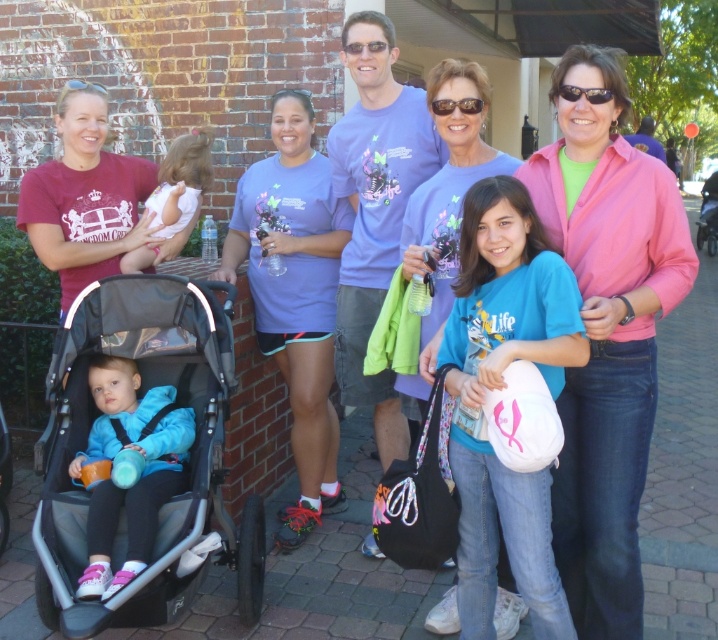
Question: Observing the image, what is the correct spatial positioning of pink fabric jacket at upper right in reference to maroon t-shirt at left?

Choices:
 (A) above
 (B) below

Answer: (B)

Question: Does pink satin jacket at center have a greater width compared to matte blue t-shirt at center?

Choices:
 (A) no
 (B) yes

Answer: (B)

Question: Which point is closer to the camera?

Choices:
 (A) black fabric stroller at lower left
 (B) light pink fabric baby at center
 (C) matte blue jacket at lower left

Answer: (A)

Question: Among these objects, which one is nearest to the camera?

Choices:
 (A) blue matte shirt at center
 (B) maroon t-shirt at left
 (C) light pink fabric baby at center

Answer: (A)

Question: Among these points, which one is farthest from the camera?

Choices:
 (A) (85, 202)
 (B) (182, 198)
 (C) (78, 497)

Answer: (B)

Question: Does maroon t-shirt at left appear on the left side of matte blue jacket at lower left?

Choices:
 (A) yes
 (B) no

Answer: (A)